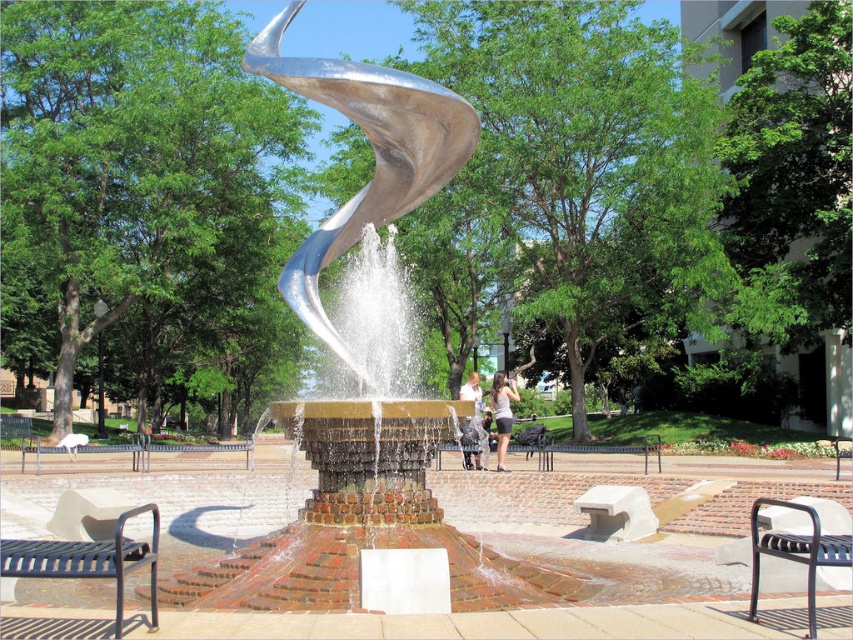
Question: In this image, where is black wrought iron bench at lower left located relative to black metal bench at lower right?

Choices:
 (A) above
 (B) below

Answer: (A)

Question: Which point is farther from the camera taking this photo?

Choices:
 (A) (646, 442)
 (B) (466, 388)
 (C) (775, 547)

Answer: (A)

Question: Does black wrought iron bench at lower left appear over black metal bench at center?

Choices:
 (A) no
 (B) yes

Answer: (B)

Question: Where is black wrought iron bench at lower left located in relation to matte gray shirt at center in the image?

Choices:
 (A) left
 (B) right

Answer: (A)

Question: Which of these objects is positioned closest to the black metal bench at center?

Choices:
 (A) black wrought iron bench at lower left
 (B) matte silver statue at center
 (C) black metal bench at lower right
 (D) matte gray shirt at center

Answer: (B)

Question: Which point is farther from the camera taking this photo?

Choices:
 (A) (846, 563)
 (B) (479, 385)

Answer: (B)